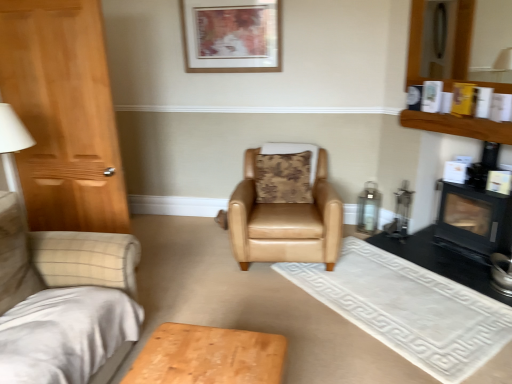
Image resolution: width=512 pixels, height=384 pixels. Identify the location of free space above wooden shelf at upper right (from a real-world perspective). (471, 115).